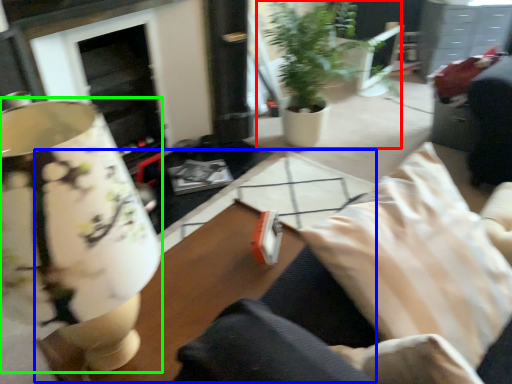
Question: Based on their relative distances, which object is farther from houseplant (highlighted by a red box)? Choose from table (highlighted by a blue box) and table lamp (highlighted by a green box).

Choices:
 (A) table
 (B) table lamp

Answer: (B)